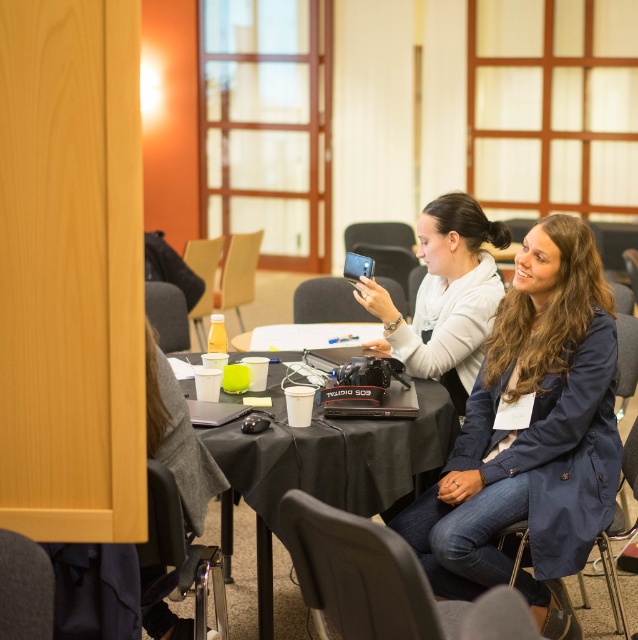
You are sitting in the black leather chair at lower left and want to reach the black fabric table at center. Which direction should you move to get there?

The black fabric table at center is positioned on the right side of the black leather chair at lower left, so you should move to your right to reach it.

You are organizing a small event and need to seat two people in the room. You have a matte black chair at left and a navy blue fabric chair at lower right. Which chair takes up more floor space?

The navy blue fabric chair at lower right takes up more floor space than the matte black chair at left because the matte black chair at left occupies less space than navy blue fabric chair at lower right.